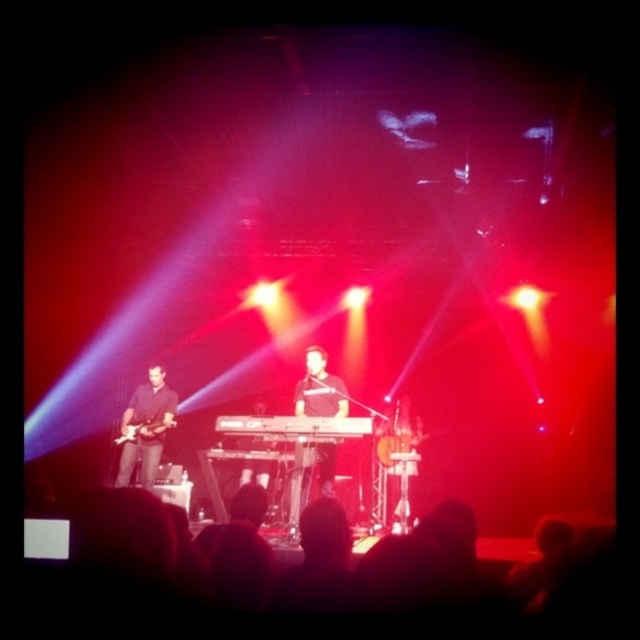
Question: Is black matte keyboardist at center to the left of black plastic keyboard at center from the viewer's perspective?

Choices:
 (A) yes
 (B) no

Answer: (B)

Question: Which object appears closest to the camera in this image?

Choices:
 (A) black matte guitar at left
 (B) black matte keyboardist at center
 (C) black plastic keyboard at center

Answer: (C)

Question: Estimate the real-world distances between objects in this image. Which object is closer to the black matte keyboardist at center?

Choices:
 (A) black plastic keyboard at center
 (B) black matte guitar at left

Answer: (A)

Question: Which point is closer to the camera?

Choices:
 (A) black matte keyboardist at center
 (B) black matte guitar at left
 (C) metallic electric guitar at left
 (D) black plastic keyboard at center

Answer: (D)

Question: Is black matte guitar at left wider than metallic electric guitar at left?

Choices:
 (A) no
 (B) yes

Answer: (B)

Question: Considering the relative positions of black matte guitar at left and black plastic keyboard at center in the image provided, where is black matte guitar at left located with respect to black plastic keyboard at center?

Choices:
 (A) right
 (B) left

Answer: (B)